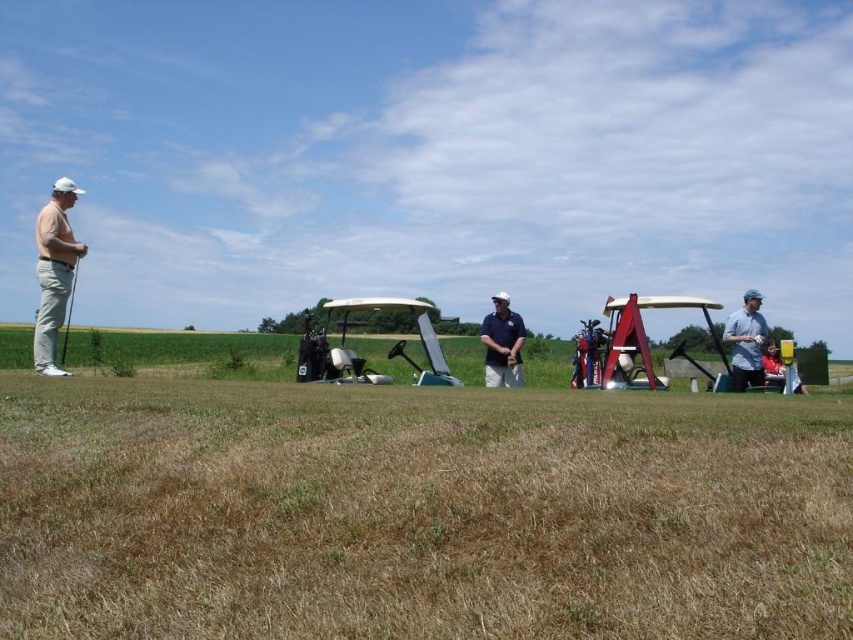
Which is below, metallic silver golf cart at center right or white plastic golf cart at center?

white plastic golf cart at center is below.

Between metallic silver golf cart at center right and white plastic golf cart at center, which one has less height?

Standing shorter between the two is white plastic golf cart at center.

Is point (645, 381) more distant than point (335, 365)?

No, (645, 381) is closer to viewer.

At what (x,y) coordinates should I click in order to perform the action: click on metallic silver golf cart at center right. Please return your answer as a coordinate pair (x, y). Image resolution: width=853 pixels, height=640 pixels. Looking at the image, I should click on (628, 342).

Can you confirm if blue cotton polo shirt at center is positioned below matte black golf club at left?

No.

Is blue cotton polo shirt at center closer to camera compared to matte black golf club at left?

No, it is behind matte black golf club at left.

Identify the location of blue cotton polo shirt at center. (502, 342).

Is metallic silver golf cart at center right further to the viewer compared to blue cotton polo shirt at center?

Yes, metallic silver golf cart at center right is behind blue cotton polo shirt at center.

Is metallic silver golf cart at center right wider than blue cotton polo shirt at center?

Yes, metallic silver golf cart at center right is wider than blue cotton polo shirt at center.

Where is `metallic silver golf cart at center right`? This screenshot has width=853, height=640. metallic silver golf cart at center right is located at coordinates (628, 342).